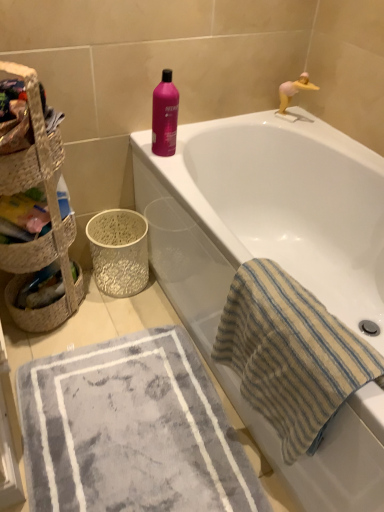
Where is `vacant space underneath gray plush bath mat at lower left (from a real-world perspective)`? The height and width of the screenshot is (512, 384). vacant space underneath gray plush bath mat at lower left (from a real-world perspective) is located at coordinates (146, 457).